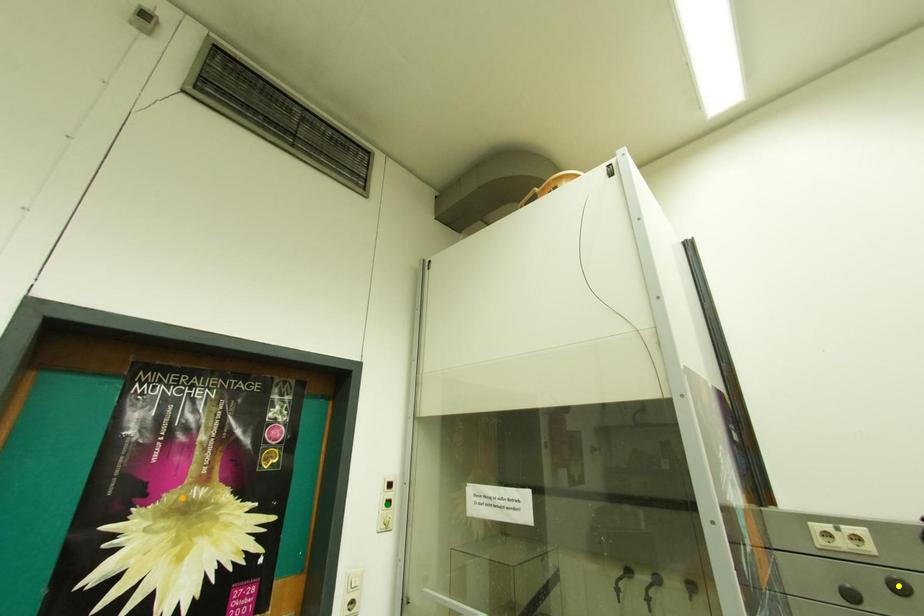
Order these from nearest to farthest:
yellow point, orange point, green point

green point < orange point < yellow point